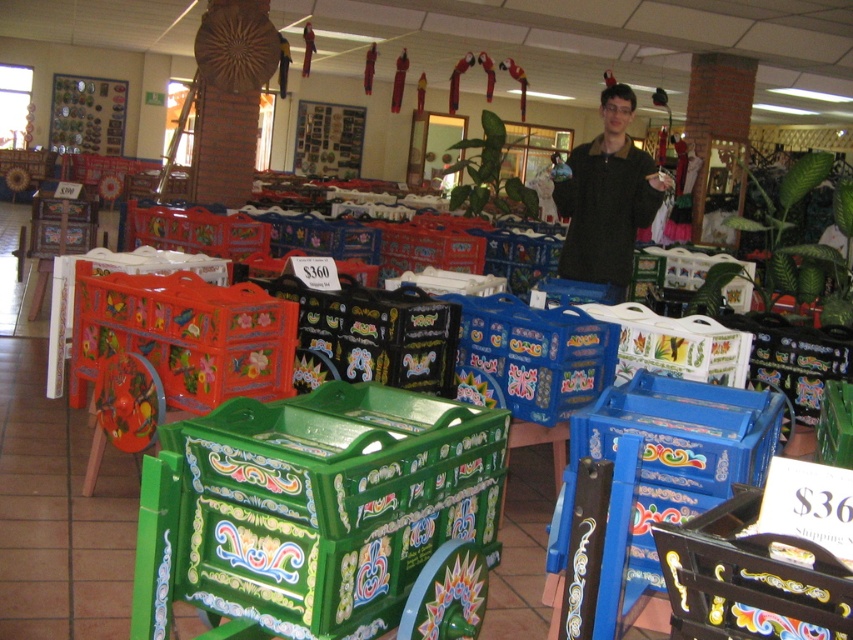
Question: Which object appears closest to the camera in this image?

Choices:
 (A) painted wood crate at center
 (B) green plastic crate at center

Answer: (A)

Question: Observing the image, what is the correct spatial positioning of green plastic crate at center in reference to dark green textured shirt at center?

Choices:
 (A) right
 (B) left

Answer: (B)

Question: Which of the following is the closest to the observer?

Choices:
 (A) green plastic crate at center
 (B) dark green textured shirt at center
 (C) painted wood crate at center

Answer: (C)

Question: Considering the real-world distances, which object is farthest from the painted wood crate at center?

Choices:
 (A) green plastic crate at center
 (B) dark green textured shirt at center

Answer: (B)

Question: Does painted wood crate at center appear on the right side of dark green textured shirt at center?

Choices:
 (A) yes
 (B) no

Answer: (B)

Question: Does painted wood crate at center come in front of dark green textured shirt at center?

Choices:
 (A) yes
 (B) no

Answer: (A)